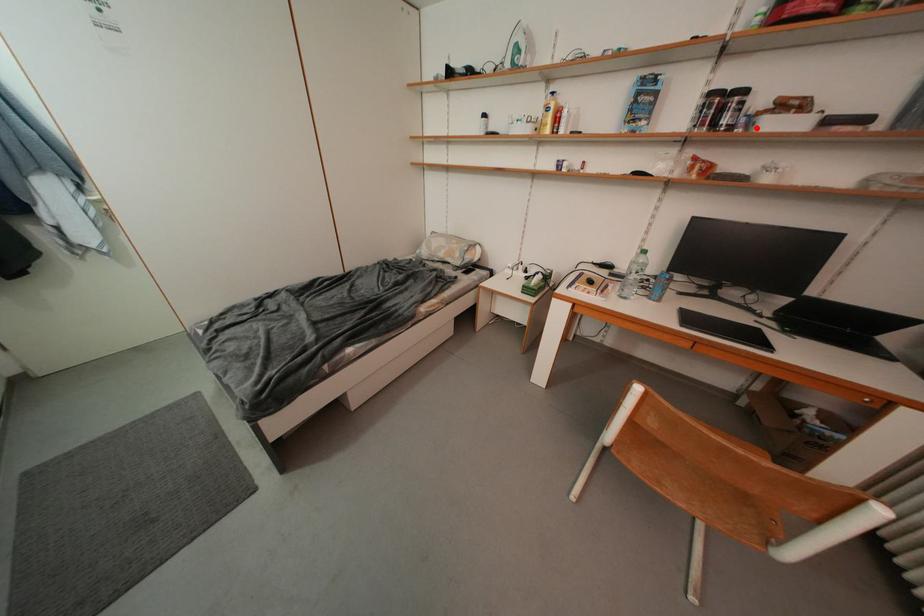
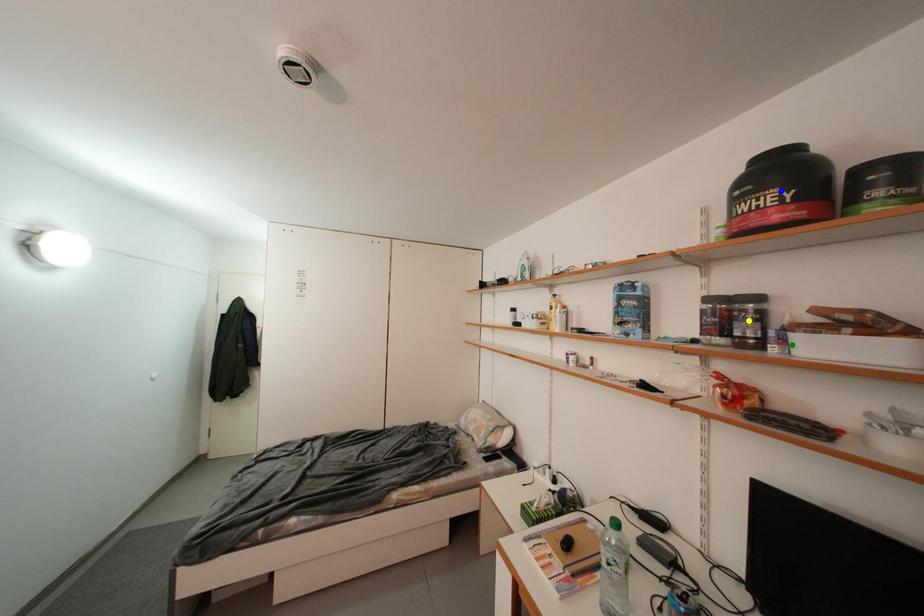
Question: I am providing you with two images of the same scene from different viewpoints. A red point is marked on the first image. You are given multiple points on the second image. Which point in image 2 represents the same 3d spot as the red point in image 1?

Choices:
 (A) green point
 (B) yellow point
 (C) blue point

Answer: (A)